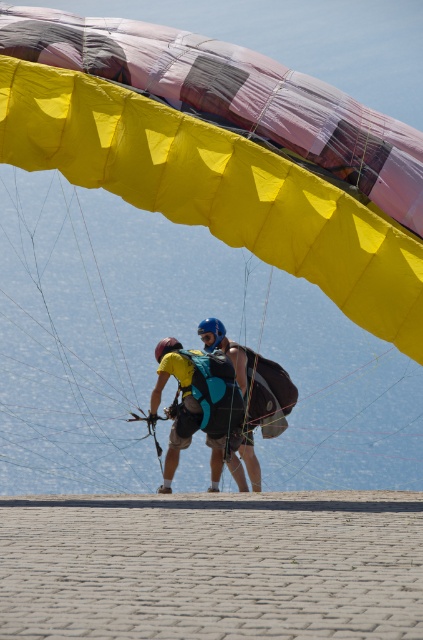
You are a paragliding instructor observing the scene. You need to ensure that the yellow matte helmet at upper center and the blue fabric backpack at center are positioned correctly for safety. Based on their current positions, which object is higher from the ground?

The yellow matte helmet at upper center is taller than the blue fabric backpack at center, so the yellow matte helmet at upper center is higher from the ground.

You are a paragliding instructor observing the scene. You notice the yellow matte helmet at upper center and the blue fabric backpack at center. Which object is located to the right of the other?

The blue fabric backpack at center is located to the right of the yellow matte helmet at upper center because the yellow matte helmet at upper center is positioned on the left side of the blue fabric backpack at center.

You are a paragliding instructor assessing the equipment setup. You notice the yellow matte helmet at upper center and the blue fabric backpack at center. Which item is bigger in size?

The yellow matte helmet at upper center is larger in size than the blue fabric backpack at center.